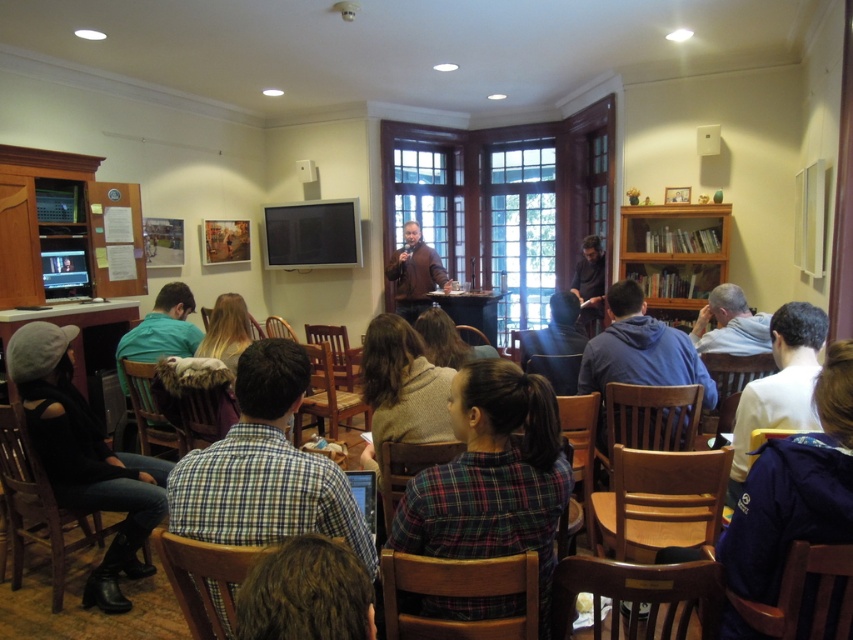
Question: In this image, where is black leather jacket at lower left located relative to dark blue sweater at center?

Choices:
 (A) right
 (B) left

Answer: (B)

Question: Which of the following is the closest to the observer?

Choices:
 (A) (705, 246)
 (B) (265, 486)
 (C) (572, 284)
 (D) (460, 316)

Answer: (B)

Question: Does plaid fabric shirt at center have a smaller size compared to teal fabric shirt at lower left?

Choices:
 (A) yes
 (B) no

Answer: (B)

Question: Estimate the real-world distances between objects in this image. Which object is closer to the wooden table at lower left?

Choices:
 (A) plaid shirt at center
 (B) dark brown leather jacket at center
 (C) brown hair at lower center
 (D) purple fabric jacket at lower right

Answer: (A)

Question: Among these points, which one is nearest to the camera?

Choices:
 (A) (547, 636)
 (B) (822, 531)

Answer: (B)

Question: Considering the relative positions of teal fabric shirt at lower left and wooden table at center in the image provided, where is teal fabric shirt at lower left located with respect to wooden table at center?

Choices:
 (A) above
 (B) below

Answer: (B)